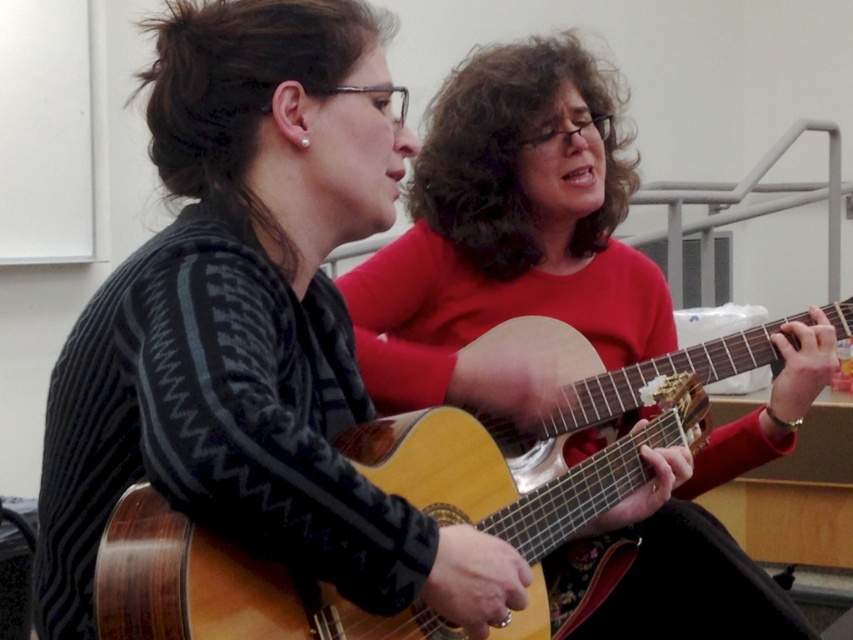
Question: Which of the following is the farthest from the observer?

Choices:
 (A) (416, 289)
 (B) (126, 509)

Answer: (A)

Question: Does matte wood guitar at center have a larger size compared to wooden acoustic guitar at center?

Choices:
 (A) no
 (B) yes

Answer: (B)

Question: Does matte wood guitar at center appear on the left side of wooden acoustic guitar at center?

Choices:
 (A) no
 (B) yes

Answer: (A)

Question: Is matte wood guitar at center bigger than wooden acoustic guitar at center?

Choices:
 (A) no
 (B) yes

Answer: (B)